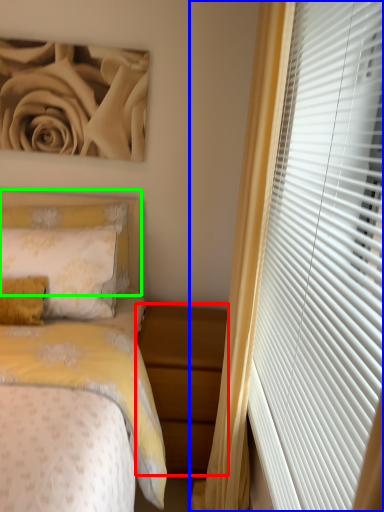
Question: Which is farther away from nightstand (highlighted by a red box)? curtain (highlighted by a blue box) or headboard (highlighted by a green box)?

Choices:
 (A) curtain
 (B) headboard

Answer: (B)